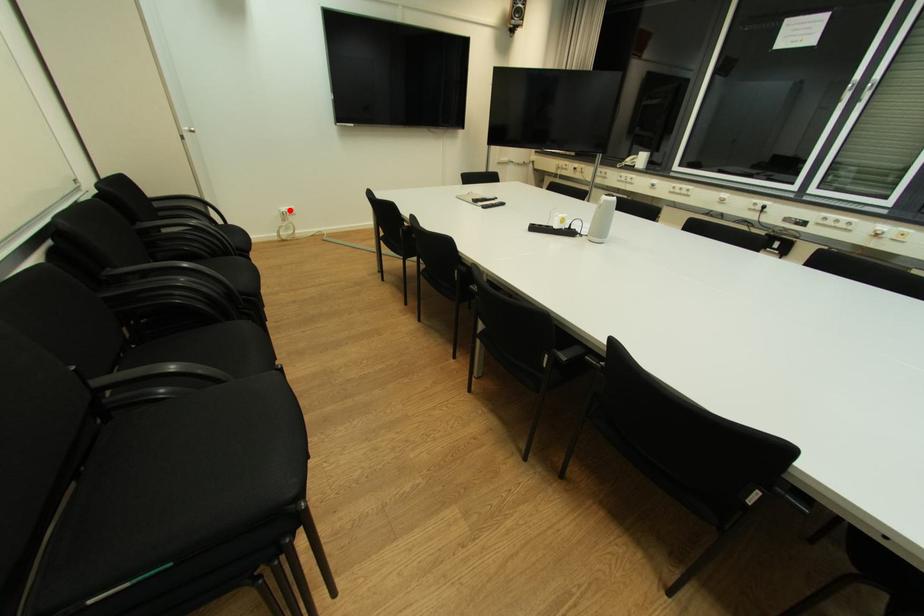
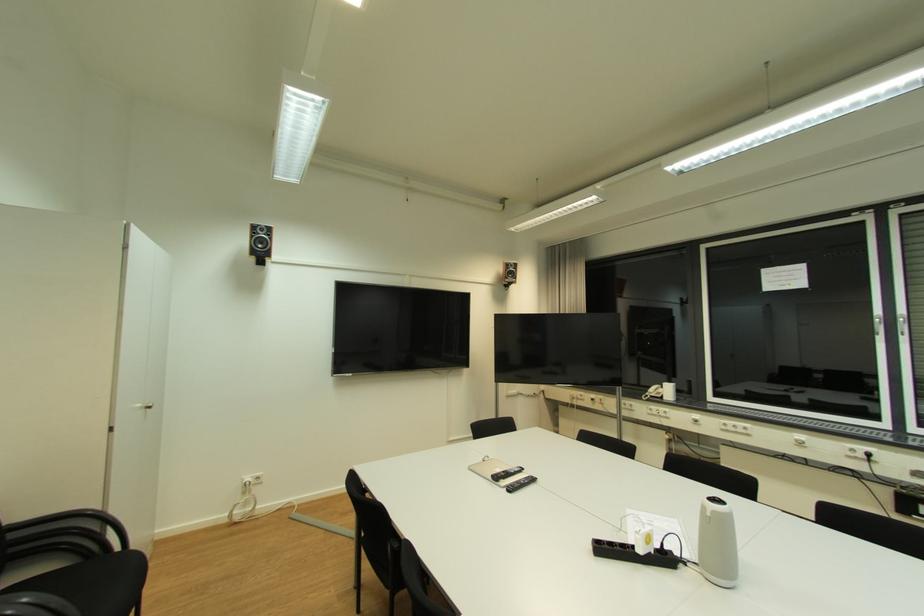
Where in the second image is the point corresponding to the highlighted location from the first image?

(253, 480)